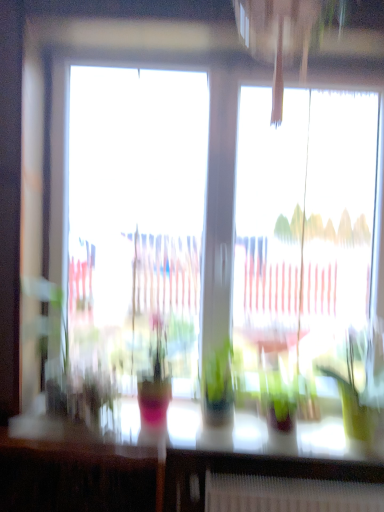
Question: Is translucent glass table at lower center turned away from transparent glass window at center?

Choices:
 (A) yes
 (B) no

Answer: (B)

Question: From the image's perspective, is translucent glass table at lower center located above transparent glass window at center?

Choices:
 (A) no
 (B) yes

Answer: (A)

Question: Does translucent glass table at lower center appear on the left side of transparent glass window at center?

Choices:
 (A) no
 (B) yes

Answer: (B)

Question: Does translucent glass table at lower center come behind transparent glass window at center?

Choices:
 (A) no
 (B) yes

Answer: (A)

Question: Considering the relative positions of translucent glass table at lower center and transparent glass window at center in the image provided, is translucent glass table at lower center in front of transparent glass window at center?

Choices:
 (A) yes
 (B) no

Answer: (A)

Question: From a real-world perspective, is translucent glass table at lower center under transparent glass window at center?

Choices:
 (A) yes
 (B) no

Answer: (A)

Question: Is the surface of transparent glass window at center in direct contact with green glossy houseplant at right?

Choices:
 (A) no
 (B) yes

Answer: (A)

Question: Is transparent glass window at center smaller than green glossy houseplant at right?

Choices:
 (A) yes
 (B) no

Answer: (B)

Question: Can you confirm if transparent glass window at center is positioned to the right of green glossy houseplant at right?

Choices:
 (A) yes
 (B) no

Answer: (B)

Question: Considering the relative sizes of transparent glass window at center and green glossy houseplant at right in the image provided, is transparent glass window at center shorter than green glossy houseplant at right?

Choices:
 (A) yes
 (B) no

Answer: (B)

Question: From the image's perspective, is transparent glass window at center located above green glossy houseplant at right?

Choices:
 (A) yes
 (B) no

Answer: (A)

Question: From a real-world perspective, is transparent glass window at center located beneath green glossy houseplant at right?

Choices:
 (A) no
 (B) yes

Answer: (A)

Question: Is transparent glass window at center wider than translucent glass table at lower center?

Choices:
 (A) yes
 (B) no

Answer: (B)